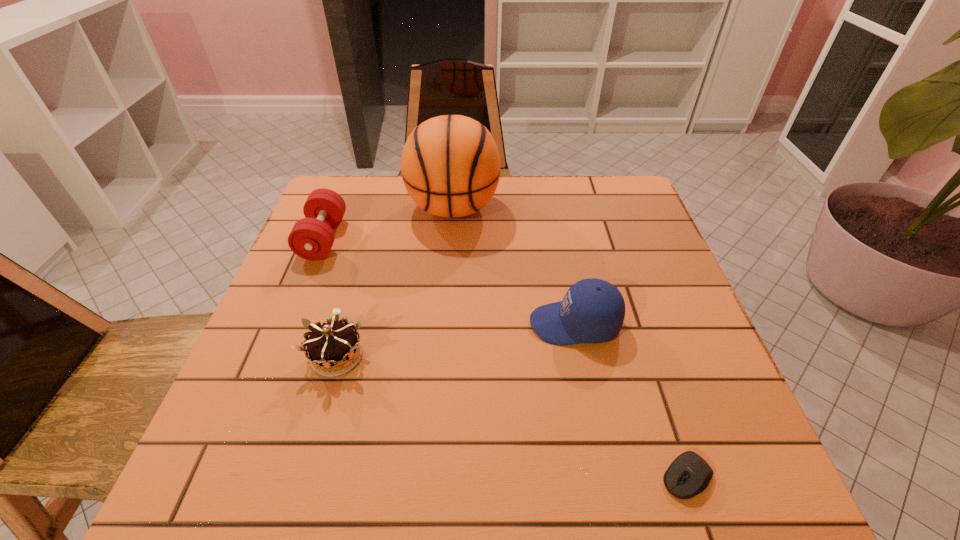
The width and height of the screenshot is (960, 540). I want to click on basketball, so click(450, 165).

Image resolution: width=960 pixels, height=540 pixels. What are the coordinates of `the third object from left to right` in the screenshot? It's located at pyautogui.click(x=450, y=165).

The width and height of the screenshot is (960, 540). Find the location of `cap`. cap is located at coordinates (592, 311).

The width and height of the screenshot is (960, 540). I want to click on dumbbell, so click(311, 238).

Find the location of `crown`. crown is located at coordinates (330, 345).

Where is `the shortest object`? the shortest object is located at coordinates (689, 474).

The image size is (960, 540). I want to click on computer equipment, so click(x=689, y=474).

Locate an element on the screen. The height and width of the screenshot is (540, 960). vacant space positioned on the right of the basketball is located at coordinates (625, 208).

At what (x,y) coordinates should I click in order to perform the action: click on blank space located 0.050m on the front-facing side of the cap. Please return your answer as a coordinate pair (x, y). The image size is (960, 540). Looking at the image, I should click on (506, 324).

At what (x,y) coordinates should I click in order to perform the action: click on vacant space located on the front-facing side of the cap. Please return your answer as a coordinate pair (x, y). This screenshot has height=540, width=960. Looking at the image, I should click on (411, 324).